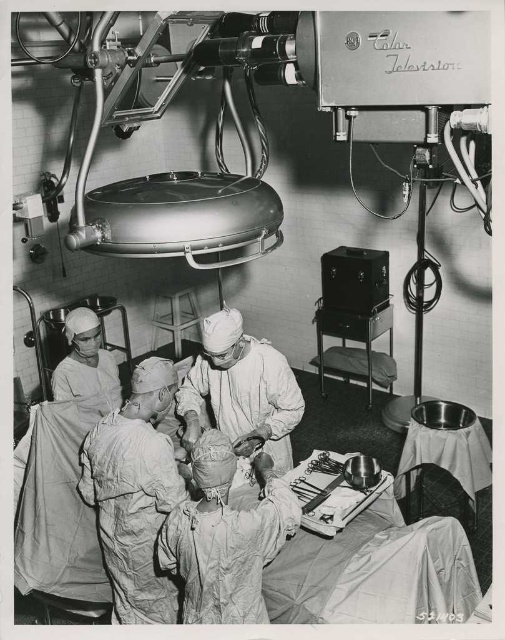
Question: Which point is closer to the camera taking this photo?

Choices:
 (A) (119, 394)
 (B) (147, 376)
 (C) (340, 476)

Answer: (B)

Question: Is white matte/soft doctor at center wider than white matte doctor at left?

Choices:
 (A) yes
 (B) no

Answer: (A)

Question: Estimate the real-world distances between objects in this image. Which object is farther from the white matte surgical gown at center?

Choices:
 (A) white matte doctor at left
 (B) metallic silver tray at center

Answer: (B)

Question: Does white matte/soft doctor at center have a smaller size compared to metallic silver tray at center?

Choices:
 (A) yes
 (B) no

Answer: (B)

Question: Observing the image, what is the correct spatial positioning of white matte surgical gown at center in reference to white matte doctor at left?

Choices:
 (A) left
 (B) right

Answer: (B)

Question: Which point is closer to the camera taking this photo?

Choices:
 (A) (216, 410)
 (B) (115, 552)
 (C) (91, 348)
 (D) (309, 467)

Answer: (B)